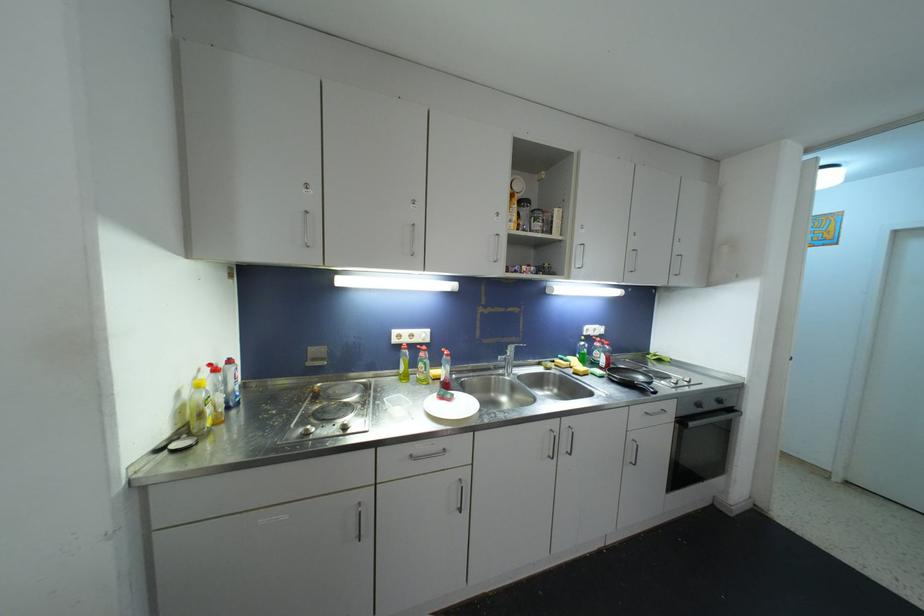
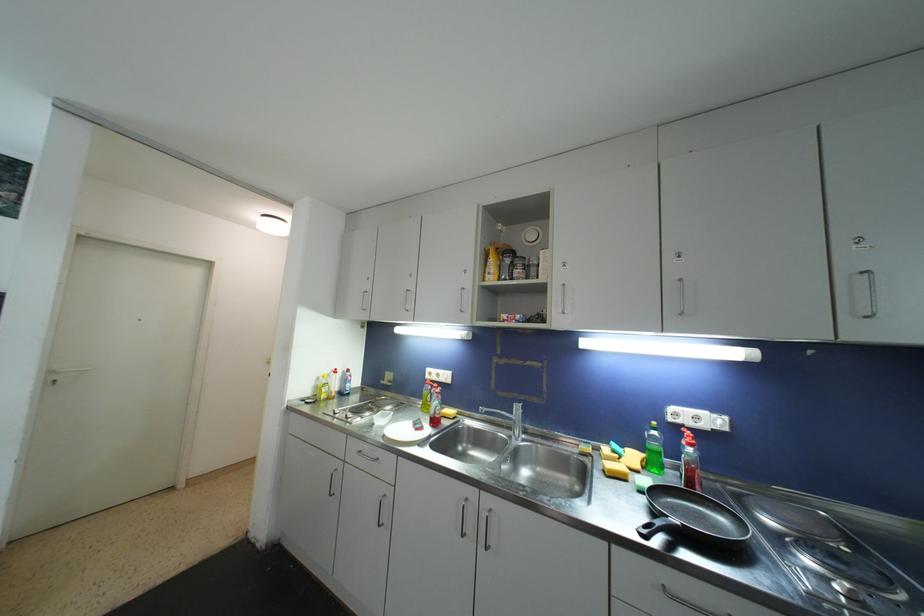
The point at (600,347) is marked in the first image. Where is the corresponding point in the second image?

(687, 445)